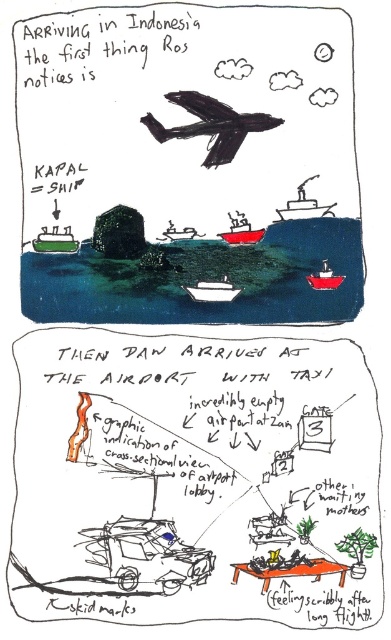
Question: Which object is farther from the camera taking this photo?

Choices:
 (A) black paper at lower center
 (B) white plastic boat at center

Answer: (B)

Question: Is white plastic boat at center to the left of green matte boat at center from the viewer's perspective?

Choices:
 (A) yes
 (B) no

Answer: (B)

Question: Among these objects, which one is nearest to the camera?

Choices:
 (A) red plastic boat at center
 (B) black matte airplane at upper center
 (C) green matte boat at center
 (D) metallic red boat at center

Answer: (B)

Question: Does black paper at lower center have a lesser width compared to red plastic boat at center?

Choices:
 (A) no
 (B) yes

Answer: (A)

Question: Among these objects, which one is nearest to the camera?

Choices:
 (A) black matte airplane at upper center
 (B) metallic red boat at center
 (C) red plastic boat at center
 (D) black paper at lower center

Answer: (D)

Question: Considering the relative positions of black paper at lower center and green matte boat at center in the image provided, where is black paper at lower center located with respect to green matte boat at center?

Choices:
 (A) right
 (B) left

Answer: (A)